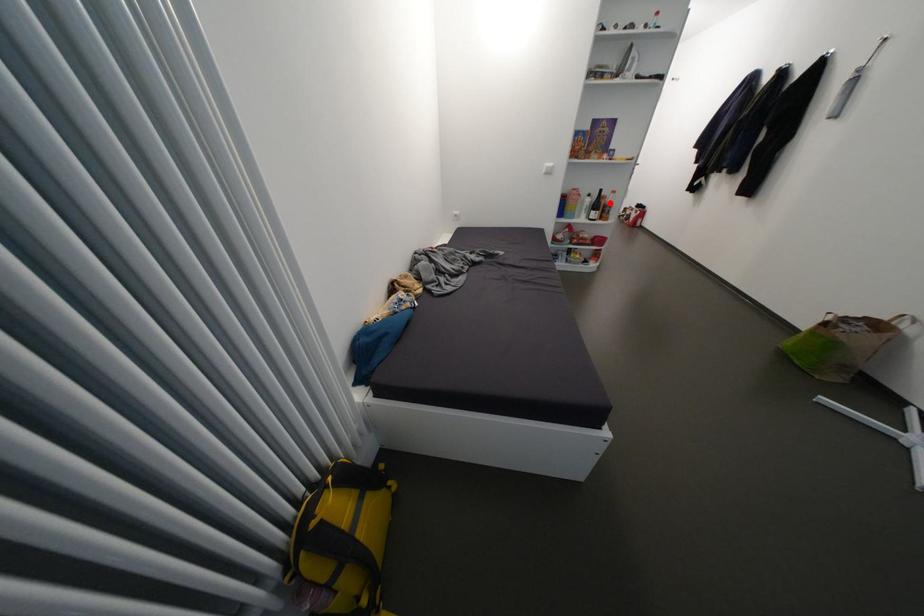
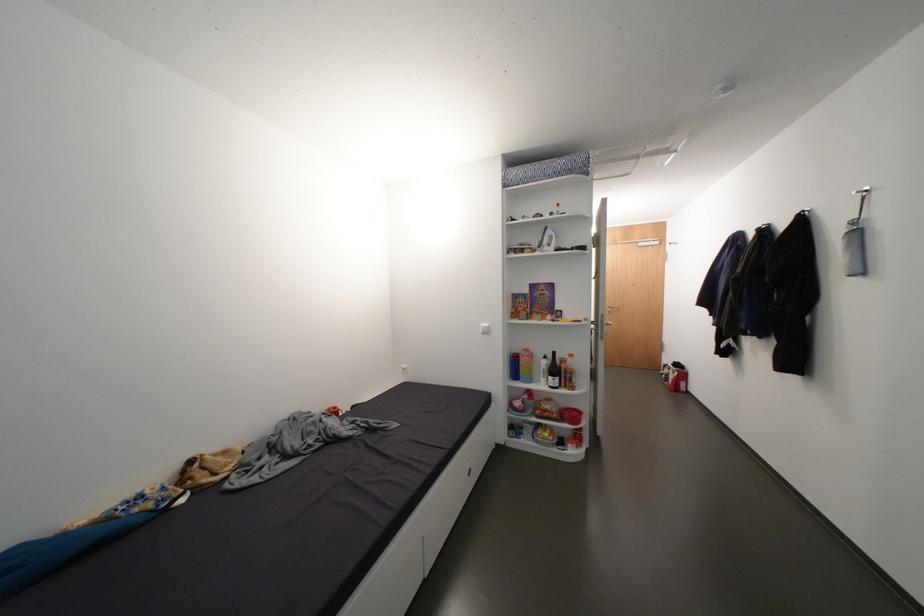
The point at the highlighted location is marked in the first image. Where is the corresponding point in the second image?

(570, 367)